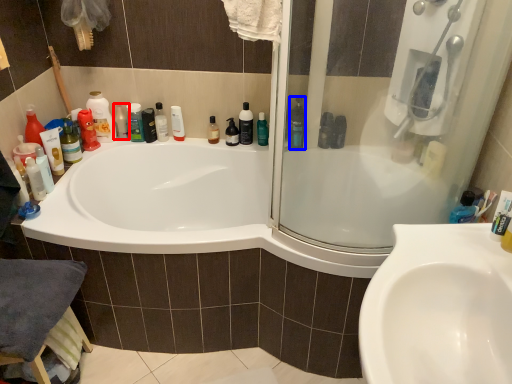
Question: Among these objects, which one is farthest to the camera, toiletry (highlighted by a red box) or cleaning product (highlighted by a blue box)?

Choices:
 (A) toiletry
 (B) cleaning product

Answer: (A)